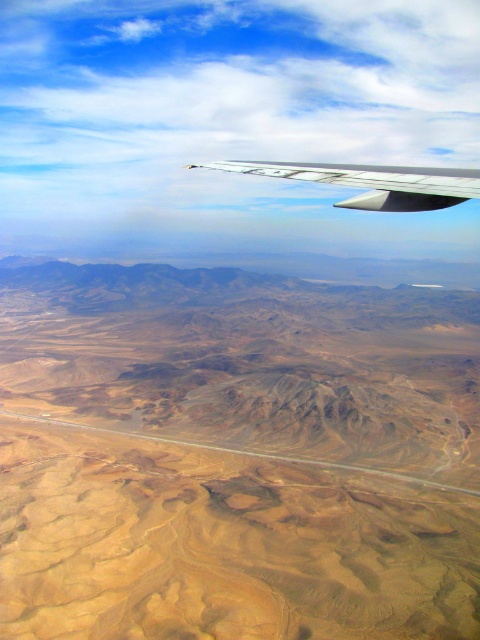
Does desert sand at lower center have a greater width compared to silver metallic wing at upper center?

Correct, the width of desert sand at lower center exceeds that of silver metallic wing at upper center.

Is desert sand at lower center to the left of silver metallic wing at upper center from the viewer's perspective?

In fact, desert sand at lower center is to the right of silver metallic wing at upper center.

Measure the distance between desert sand at lower center and camera.

desert sand at lower center is 242.06 meters from camera.

Find the location of a particular element. desert sand at lower center is located at coordinates (235, 456).